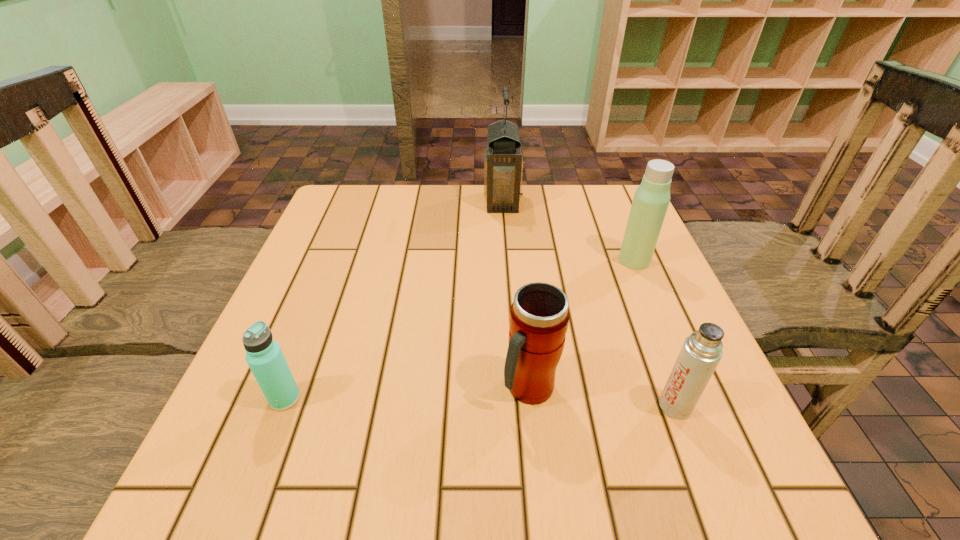
Image resolution: width=960 pixels, height=540 pixels. In order to click on the tallest object in this screenshot , I will do `click(503, 162)`.

What are the coordinates of `lantern` in the screenshot? It's located at (503, 162).

The image size is (960, 540). Identify the location of the fourth nearest object. (651, 199).

Where is `the second thermos bottle from left to right`? the second thermos bottle from left to right is located at coordinates [x=539, y=316].

The width and height of the screenshot is (960, 540). Identify the location of the leftmost thermos bottle. (264, 356).

At what (x,y) coordinates should I click in order to perform the action: click on free location located 0.170m on the front-facing side of the farthest object. Please return your answer as a coordinate pair (x, y). This screenshot has width=960, height=540. Looking at the image, I should click on [421, 202].

Where is `free region located 0.110m on the front-facing side of the farthest object`? The width and height of the screenshot is (960, 540). free region located 0.110m on the front-facing side of the farthest object is located at coordinates coord(444,202).

In order to click on free region located on the front-facing side of the farthest object in this screenshot , I will do `click(411, 202)`.

The width and height of the screenshot is (960, 540). I want to click on vacant space located 0.300m on the front of the farthest thermos bottle, so click(685, 382).

Identify the location of free space located on the side with the handle of the third thermos bottle from right to left. The width and height of the screenshot is (960, 540). (540, 496).